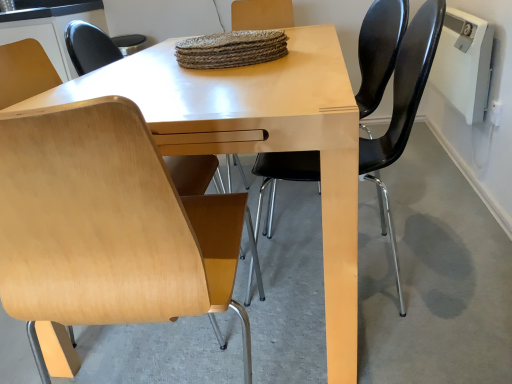
Find the location of a particular element. This screenshot has height=384, width=512. free space to the back side of black leather chair at right, positioned as the second chair in left-to-right order is located at coordinates (320, 216).